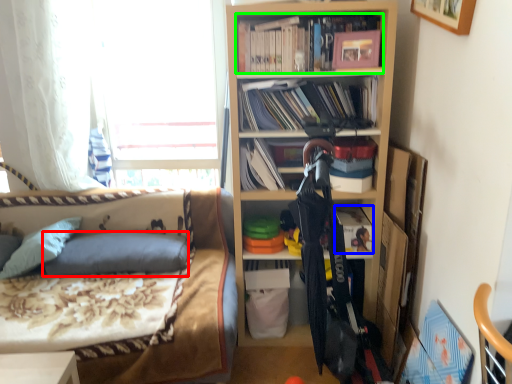
Question: Based on their relative distances, which object is nearer to pillow (highlighted by a red box)? Choose from book (highlighted by a blue box) and book (highlighted by a green box).

Choices:
 (A) book
 (B) book

Answer: (A)